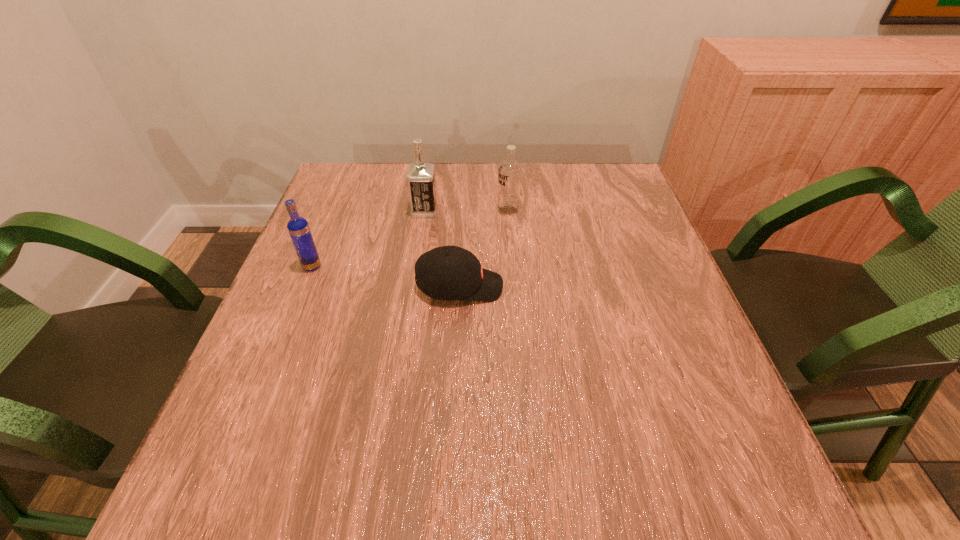
Select which vodka appears as the second closest to the second vodka from right to left. Please provide its 2D coordinates. Your answer should be formatted as a tuple, i.e. [(x, y)], where the tuple contains the x and y coordinates of a point satisfying the conditions above.

[(298, 227)]

The height and width of the screenshot is (540, 960). Identify the location of vodka that is the closest to the rightmost vodka. (421, 182).

Locate an element on the screen. This screenshot has width=960, height=540. blank area in the image that satisfies the following two spatial constraints: 1. on the front label of the rightmost vodka; 2. on the front side of the nearest vodka is located at coordinates (513, 266).

Find the location of a particular element. free location that satisfies the following two spatial constraints: 1. on the front label of the second vodka from left to right; 2. on the front side of the nearest vodka is located at coordinates (416, 266).

Find the location of a particular element. The image size is (960, 540). vacant area in the image that satisfies the following two spatial constraints: 1. on the front label of the second vodka from right to left; 2. on the front side of the nearest vodka is located at coordinates (416, 266).